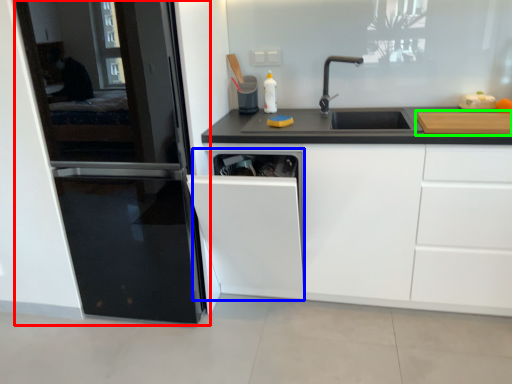
Question: Considering the real-world distances, which object is closest to home appliance (highlighted by a red box)? dish washer (highlighted by a blue box) or cutting board (highlighted by a green box).

Choices:
 (A) dish washer
 (B) cutting board

Answer: (A)